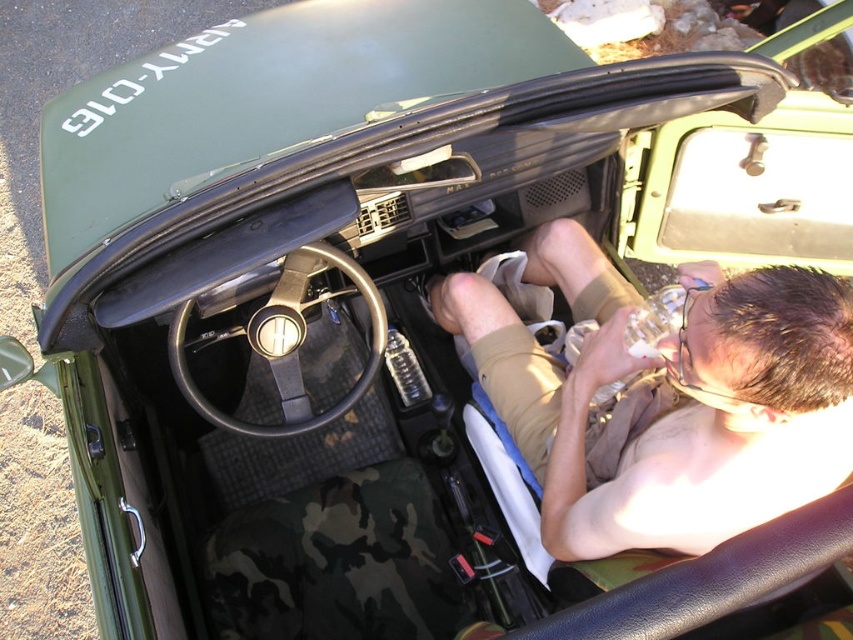
You are a mechanic inspecting the interior of a vintage military Jeep. You notice a tan fabric leg at center and a black rubber steering wheel at center. Which object takes up more space in the vehicle?

The tan fabric leg at center is bigger than the black rubber steering wheel at center, so it takes up more space in the vehicle.

You are a mechanic working on a vintage Jeep with the hood open. You need to reach the tan fabric leg at center located inside the vehicle. Considering your arm can extend 36 inches, can you comfortably reach it without moving your body?

The distance between the tan fabric leg at center and the camera is 38.57 inches. Since your arm can only extend 36 inches, you cannot comfortably reach it without moving your body.

You are a mechanic working on the vintage Jeep. You need to access the engine compartment. Is the tan fabric leg at center in your way?

The tan fabric leg at center is located at point (x=666, y=397) in the image, which is near the center of the vehicle. Since the engine compartment is under the hood, which is open, and the leg is inside the cabin area, it is not blocking access to the engine. Therefore, the tan fabric leg at center is not in your way.